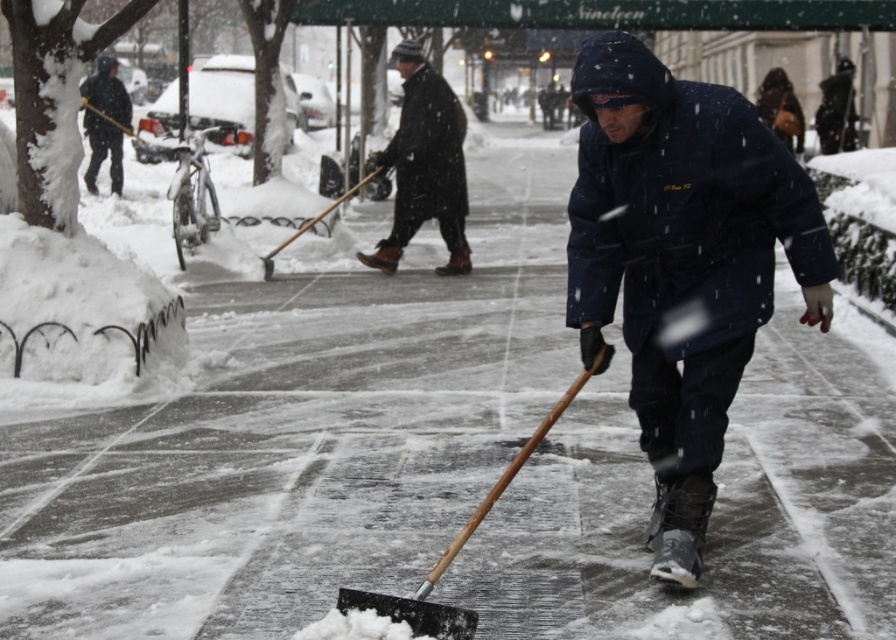
Question: Is dark woolen coat at center below wooden shovel at center?

Choices:
 (A) no
 (B) yes

Answer: (A)

Question: Which point is closer to the camera taking this photo?

Choices:
 (A) (625, 323)
 (B) (533, 436)

Answer: (B)

Question: Which object is the farthest from the wooden shovel at center?

Choices:
 (A) dark woolen coat at center
 (B) black plastic shovel at center
 (C) dark blue hooded jacket at center

Answer: (B)

Question: Can you confirm if dark blue jacket at upper left is positioned to the left of wooden shovel at center?

Choices:
 (A) yes
 (B) no

Answer: (A)

Question: Which of the following is the closest to the observer?

Choices:
 (A) (786, 221)
 (B) (446, 221)
 (C) (452, 625)
 (D) (313, 221)

Answer: (C)

Question: Is black plastic shovel at center below wooden shovel at center?

Choices:
 (A) yes
 (B) no

Answer: (A)